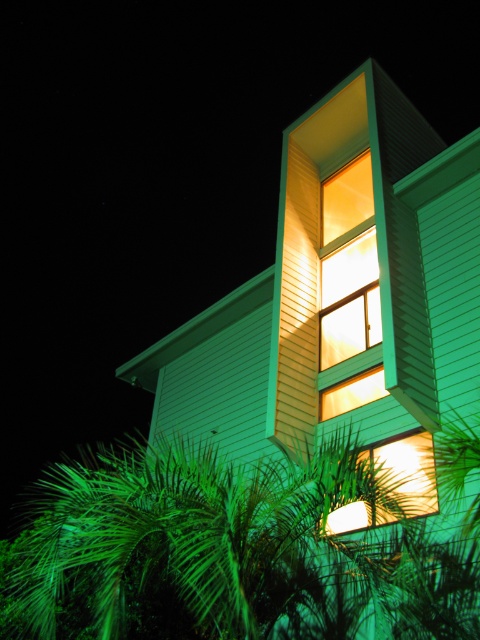
Question: Does matte glass window at center lie in front of matte glass window at lower right?

Choices:
 (A) yes
 (B) no

Answer: (B)

Question: Which object appears farthest from the camera in this image?

Choices:
 (A) matte glass window at lower right
 (B) matte glass window at center

Answer: (B)

Question: Which point is closer to the camera taking this photo?

Choices:
 (A) (334, 404)
 (B) (415, 492)

Answer: (B)

Question: Is matte glass window at center thinner than matte glass window at lower right?

Choices:
 (A) yes
 (B) no

Answer: (A)

Question: Is matte glass window at center to the right of matte glass window at lower right from the viewer's perspective?

Choices:
 (A) yes
 (B) no

Answer: (B)